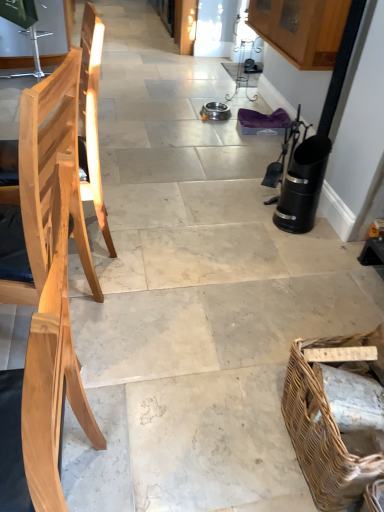
This screenshot has width=384, height=512. I want to click on free space that is in between natural wood chair at left, acting as the first chair starting from the bottom, and brown woven picnic basket at lower right, so click(x=202, y=457).